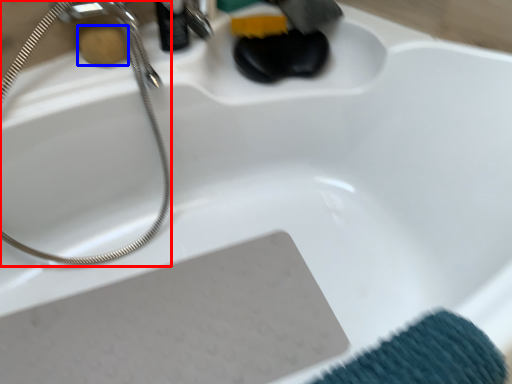
Question: Which of the following is the farthest to the observer, shower (highlighted by a red box) or soap (highlighted by a blue box)?

Choices:
 (A) shower
 (B) soap

Answer: (B)